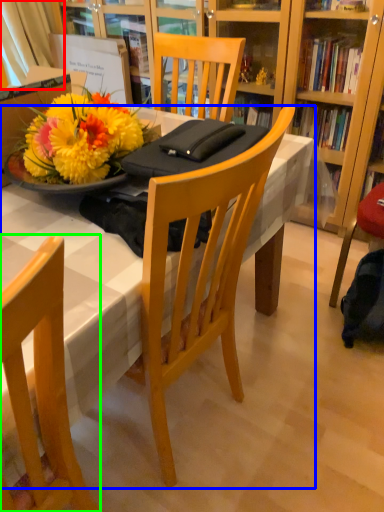
Question: Estimate the real-world distances between objects in this image. Which object is closer to curtain (highlighted by a red box), desk (highlighted by a blue box) or chair (highlighted by a green box)?

Choices:
 (A) desk
 (B) chair

Answer: (A)